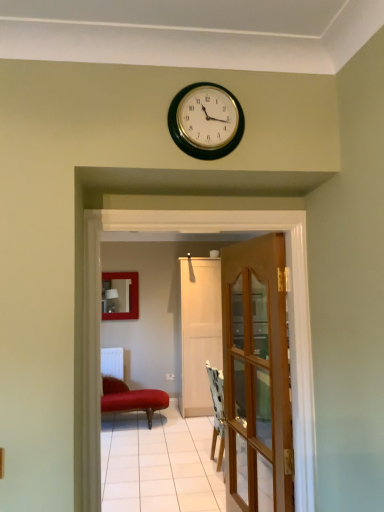
Where is `white glossy door at center`? white glossy door at center is located at coordinates click(x=201, y=233).

The image size is (384, 512). Identify the location of smooth leather ottoman at center. 159,463.

What do you see at coordinates (198, 331) in the screenshot? I see `white matte door at center, the first door viewed from the back` at bounding box center [198, 331].

The height and width of the screenshot is (512, 384). I want to click on white matte door at center, placed as the 2th door when sorted from front to back, so click(x=198, y=331).

What is the approximate height of wooden glass door at center, acting as the 1th door starting from the front?

The height of wooden glass door at center, acting as the 1th door starting from the front, is 4.95 feet.

The image size is (384, 512). Identify the location of wooden glass door at center, acting as the 1th door starting from the front. (257, 375).

Where is `velvet red studio couch at center`? Image resolution: width=384 pixels, height=512 pixels. velvet red studio couch at center is located at coordinates (131, 398).

The image size is (384, 512). I want to click on patterned fabric chair at center, so click(x=217, y=411).

You are a GUI agent. You are given a task and a screenshot of the screen. Output one action in this format:
    pyautogui.click(x=<x>, y=<y>)
    Task: Click on the white glossy door at center
    
    Given the screenshot: What is the action you would take?
    pyautogui.click(x=201, y=233)

Considering the relative positions of patterned fabric chair at center and metallic gold clock at upper center in the image provided, is patterned fabric chair at center in front of metallic gold clock at upper center?

No, the depth of patterned fabric chair at center is greater than that of metallic gold clock at upper center.

From a real-world perspective, is patterned fabric chair at center physically located above or below metallic gold clock at upper center?

From a real-world perspective, patterned fabric chair at center is physically below metallic gold clock at upper center.

How different are the orientations of patterned fabric chair at center and metallic gold clock at upper center in degrees?

88.9 degrees separate the facing orientations of patterned fabric chair at center and metallic gold clock at upper center.

In order to click on the 2nd door behind the metallic gold clock at upper center, counting from the anchor's position in this screenshot , I will do coord(198,331).

Is metallic gold clock at upper center touching white matte door at center, the first door viewed from the back?

No, metallic gold clock at upper center is not with white matte door at center, the first door viewed from the back.

Considering the relative sizes of metallic gold clock at upper center and white matte door at center, placed as the 2th door when sorted from front to back, in the image provided, is metallic gold clock at upper center bigger than white matte door at center, placed as the 2th door when sorted from front to back,?

No.

Which object is positioned more to the right, metallic gold clock at upper center or white matte door at center, placed as the 2th door when sorted from front to back?

white matte door at center, placed as the 2th door when sorted from front to back.

Choose the correct answer: Is metallic gold clock at upper center inside smooth leather ottoman at center or outside it?

metallic gold clock at upper center exists outside the volume of smooth leather ottoman at center.

What's the angular difference between metallic gold clock at upper center and smooth leather ottoman at center's facing directions?

They differ by 179 degrees in their facing directions.

From a real-world perspective, which is physically above, metallic gold clock at upper center or smooth leather ottoman at center?

metallic gold clock at upper center.

Looking at this image, looking at the image, does metallic gold clock at upper center seem bigger or smaller compared to smooth leather ottoman at center?

Clearly, metallic gold clock at upper center is smaller in size than smooth leather ottoman at center.

Which object is positioned more to the left, white matte door at center, the first door viewed from the back, or patterned fabric chair at center?

From the viewer's perspective, white matte door at center, the first door viewed from the back, appears more on the left side.

Is patterned fabric chair at center completely or partially inside white matte door at center, the first door viewed from the back?

Definitely not — patterned fabric chair at center is not inside white matte door at center, the first door viewed from the back.

This screenshot has height=512, width=384. I want to click on chair below the white matte door at center, placed as the 2th door when sorted from front to back (from the image's perspective), so click(x=217, y=411).

From a real-world perspective, is white matte door at center, the first door viewed from the back, positioned over patterned fabric chair at center based on gravity?

Yes, from a real-world perspective, white matte door at center, the first door viewed from the back, is on top of patterned fabric chair at center.

Is velvet red studio couch at center far away from metallic gold clock at upper center?

Yes, velvet red studio couch at center and metallic gold clock at upper center are quite far apart.

Does velvet red studio couch at center lie behind metallic gold clock at upper center?

Yes, velvet red studio couch at center is behind metallic gold clock at upper center.

In the scene shown: Between velvet red studio couch at center and metallic gold clock at upper center, which one appears on the left side from the viewer's perspective?

From the viewer's perspective, velvet red studio couch at center appears more on the left side.

Does velvet red studio couch at center appear on the left side of smooth leather ottoman at center?

Correct, you'll find velvet red studio couch at center to the left of smooth leather ottoman at center.

Which point is more distant from viewer, (131, 401) or (116, 429)?

The point (131, 401) is farther from the camera.

Who is taller, velvet red studio couch at center or smooth leather ottoman at center?

Standing taller between the two is velvet red studio couch at center.

Between metallic gold clock at upper center and patterned fabric chair at center, which one appears on the left side from the viewer's perspective?

metallic gold clock at upper center is more to the left.

How much distance is there between metallic gold clock at upper center and patterned fabric chair at center?

metallic gold clock at upper center and patterned fabric chair at center are 3.20 meters apart.

Locate an element on the screen. The width and height of the screenshot is (384, 512). wall clock above the patterned fabric chair at center (from a real-world perspective) is located at coordinates (206, 121).

How many degrees apart are the facing directions of metallic gold clock at upper center and patterned fabric chair at center?

They differ by 88.9 degrees in their facing directions.

Identify the location of wall clock in front of the patterned fabric chair at center. (206, 121).

This screenshot has height=512, width=384. Find the location of `wall clock positioned vertically above the white matte door at center, the first door viewed from the back (from a real-world perspective)`. wall clock positioned vertically above the white matte door at center, the first door viewed from the back (from a real-world perspective) is located at coordinates (206, 121).

Which object lies nearer to the anchor point smooth leather ottoman at center, patterned fabric chair at center or velvet red studio couch at center?

The object closer to smooth leather ottoman at center is velvet red studio couch at center.

Looking at the image, which one is located closer to wooden glass door at center, the 2th door in the back-to-front sequence, white glossy door at center or white matte door at center, placed as the 2th door when sorted from front to back?

The object closer to wooden glass door at center, the 2th door in the back-to-front sequence, is white glossy door at center.

Which object lies nearer to the anchor point white glossy door at center, patterned fabric chair at center or white matte door at center, placed as the 2th door when sorted from front to back?

The object closer to white glossy door at center is patterned fabric chair at center.

From the image, which object appears to be nearer to metallic gold clock at upper center, white glossy door at center or patterned fabric chair at center?

white glossy door at center.

When comparing their distances from metallic gold clock at upper center, does smooth leather ottoman at center or patterned fabric chair at center seem further?

smooth leather ottoman at center lies further to metallic gold clock at upper center than the other object.

Based on their spatial positions, is metallic gold clock at upper center or smooth leather ottoman at center further from wooden glass door at center, the 2th door in the back-to-front sequence?

Among the two, smooth leather ottoman at center is located further to wooden glass door at center, the 2th door in the back-to-front sequence.

From the image, which object appears to be farther from velvet red studio couch at center, white glossy door at center or patterned fabric chair at center?

The object further to velvet red studio couch at center is white glossy door at center.

From the image, which object appears to be nearer to white glossy door at center, velvet red studio couch at center or white matte door at center, the first door viewed from the back?

velvet red studio couch at center is closer to white glossy door at center.

The image size is (384, 512). I want to click on chair between white glossy door at center and velvet red studio couch at center in the front-back direction, so click(217, 411).

I want to click on door located between metallic gold clock at upper center and patterned fabric chair at center in the depth direction, so click(x=257, y=375).

Locate an element on the screen. The width and height of the screenshot is (384, 512). path located between metallic gold clock at upper center and patterned fabric chair at center in the depth direction is located at coordinates (159, 463).

I want to click on studio couch between smooth leather ottoman at center and white matte door at center, placed as the 2th door when sorted from front to back, along the z-axis, so click(x=131, y=398).